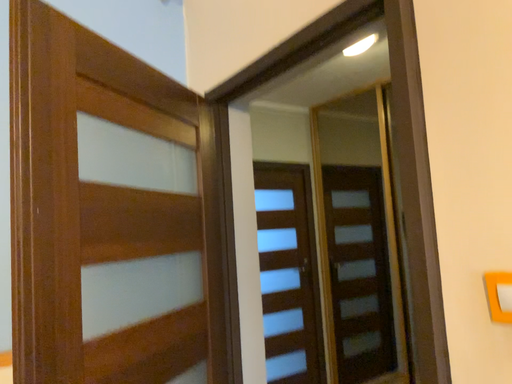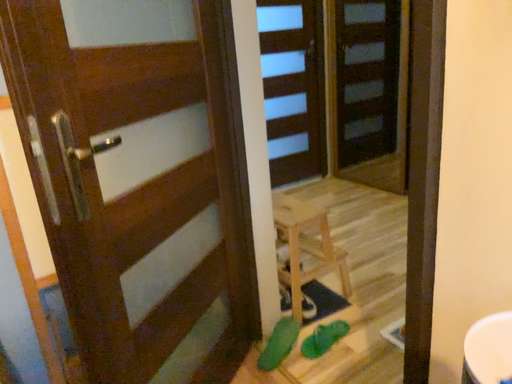
Question: How did the camera likely rotate when shooting the video?

Choices:
 (A) rotated upward
 (B) rotated downward

Answer: (B)